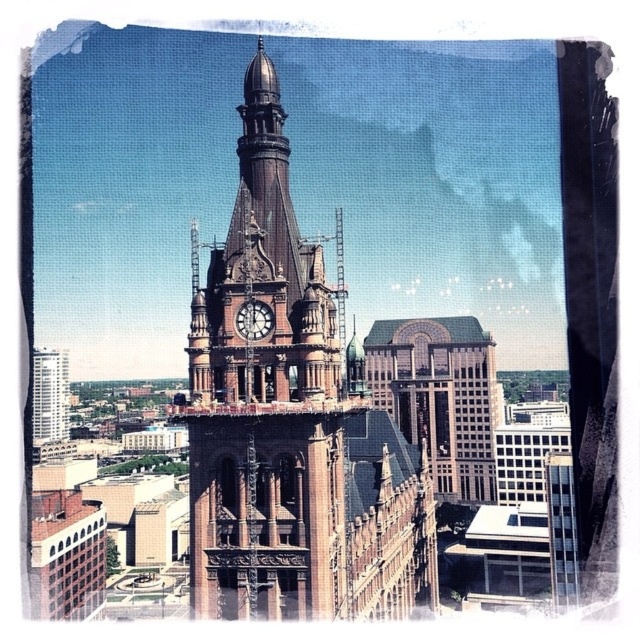
Question: Considering the real-world distances, which object is farthest from the brown brick clock tower at center?

Choices:
 (A) polished brass clock at center
 (B) brick building at center
 (C) white glass skyscraper at left

Answer: (B)

Question: Can you confirm if brick building at center is wider than polished brass clock at center?

Choices:
 (A) yes
 (B) no

Answer: (A)

Question: Is brown brick clock tower at center to the right of polished brass clock at center from the viewer's perspective?

Choices:
 (A) no
 (B) yes

Answer: (A)

Question: Does brown brick clock tower at center have a larger size compared to brick building at center?

Choices:
 (A) yes
 (B) no

Answer: (A)

Question: Which is farther from the brown brick clock tower at center?

Choices:
 (A) white glass skyscraper at left
 (B) polished brass clock at center
 (C) brick building at center

Answer: (C)

Question: Which point is farther from the camera taking this photo?

Choices:
 (A) (51, 412)
 (B) (211, 605)
 (C) (412, 426)
 (D) (241, 324)

Answer: (A)